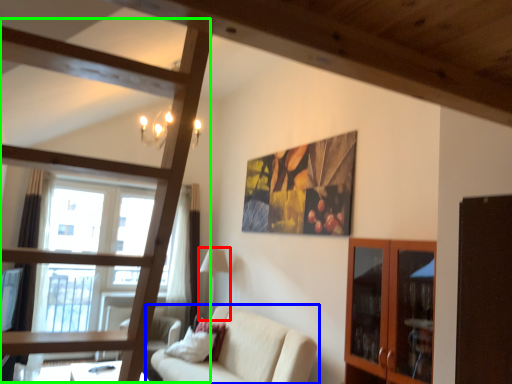
Question: Estimate the real-world distances between objects in this image. Which object is farther from lamp (highlighted by a red box), studio couch (highlighted by a blue box) or bunk bed (highlighted by a green box)?

Choices:
 (A) studio couch
 (B) bunk bed

Answer: (B)